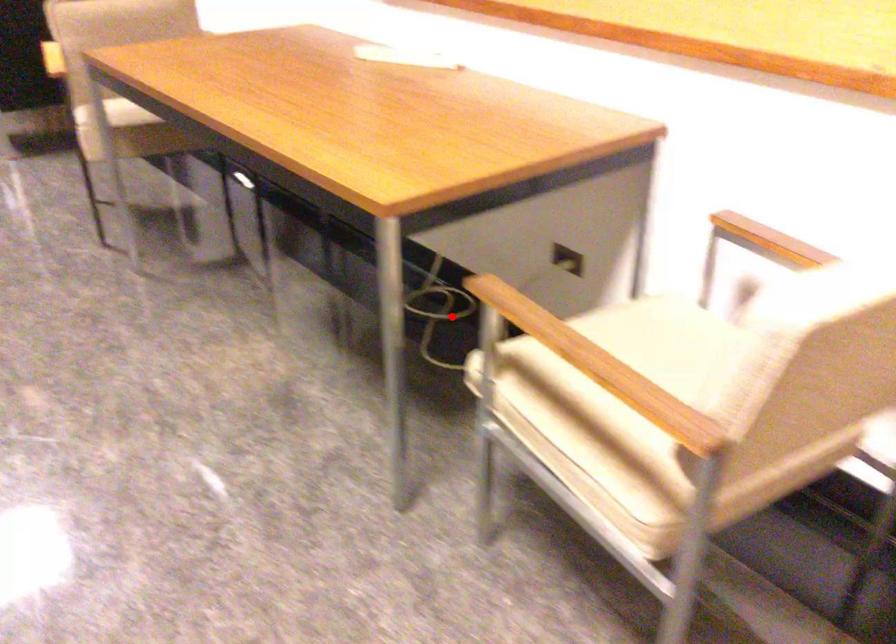
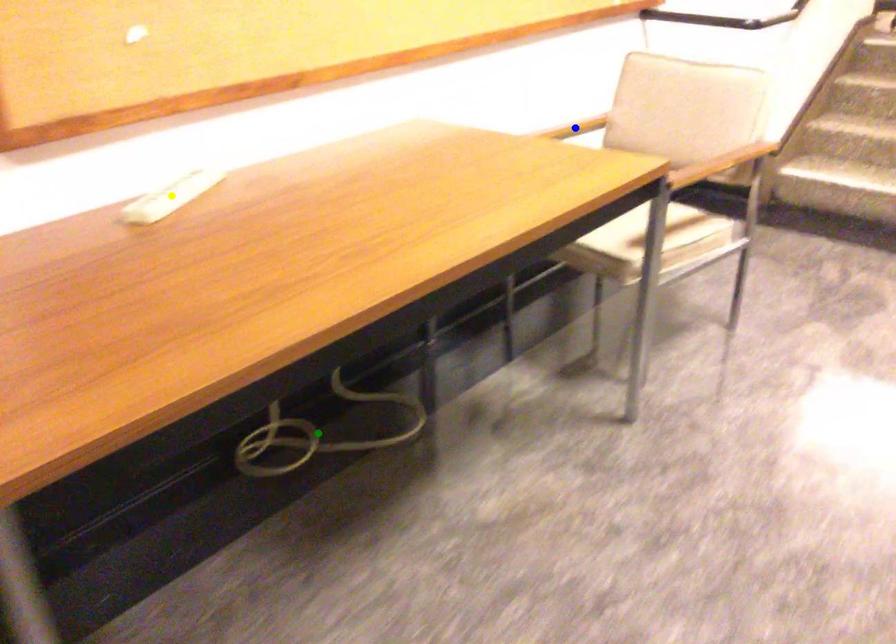
Question: I am providing you with two images of the same scene from different viewpoints. A red point is marked on the first image. You are given multiple points on the second image. In image 2, which mark is for the same physical point as the one in image 1?

Choices:
 (A) blue point
 (B) green point
 (C) yellow point

Answer: (B)